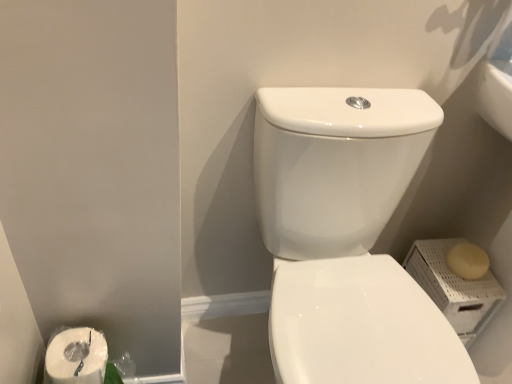
Question: Can you confirm if white matte soap at right is shorter than white glossy toilet at center?

Choices:
 (A) no
 (B) yes

Answer: (B)

Question: Is white matte soap at right located outside white glossy toilet at center?

Choices:
 (A) yes
 (B) no

Answer: (A)

Question: Is white matte soap at right at the left side of white glossy toilet at center?

Choices:
 (A) yes
 (B) no

Answer: (B)

Question: Are white matte soap at right and white glossy toilet at center beside each other?

Choices:
 (A) yes
 (B) no

Answer: (B)

Question: Would you say white matte soap at right is a long distance from white glossy toilet at center?

Choices:
 (A) yes
 (B) no

Answer: (B)

Question: From the image's perspective, is white matte soap at right above white glossy toilet at center?

Choices:
 (A) yes
 (B) no

Answer: (A)

Question: Can you confirm if white glossy toilet at center is thinner than white matte soap at right?

Choices:
 (A) yes
 (B) no

Answer: (B)

Question: Is white matte soap at right completely or partially inside white glossy toilet at center?

Choices:
 (A) yes
 (B) no

Answer: (B)

Question: Is white glossy toilet at center bigger than white matte soap at right?

Choices:
 (A) no
 (B) yes

Answer: (B)

Question: Considering the relative sizes of white glossy toilet at center and white matte soap at right in the image provided, is white glossy toilet at center taller than white matte soap at right?

Choices:
 (A) no
 (B) yes

Answer: (B)

Question: Considering the relative positions of white glossy toilet at center and white matte soap at right in the image provided, is white glossy toilet at center to the left of white matte soap at right from the viewer's perspective?

Choices:
 (A) no
 (B) yes

Answer: (B)

Question: Does white glossy toilet at center have a lesser height compared to white matte soap at right?

Choices:
 (A) yes
 (B) no

Answer: (B)

Question: From the image's perspective, is white glossy toilet at center located above or below white matte soap at right?

Choices:
 (A) above
 (B) below

Answer: (B)